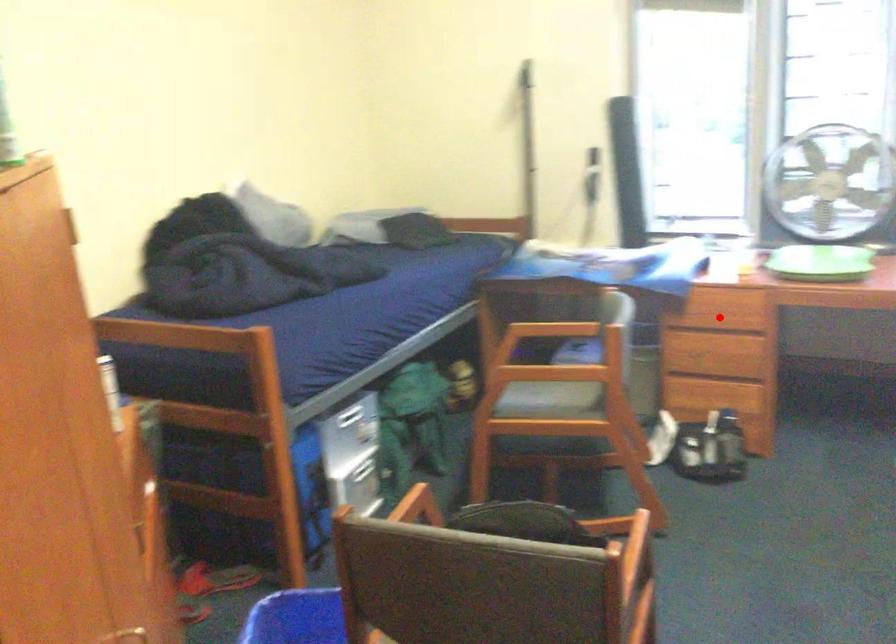
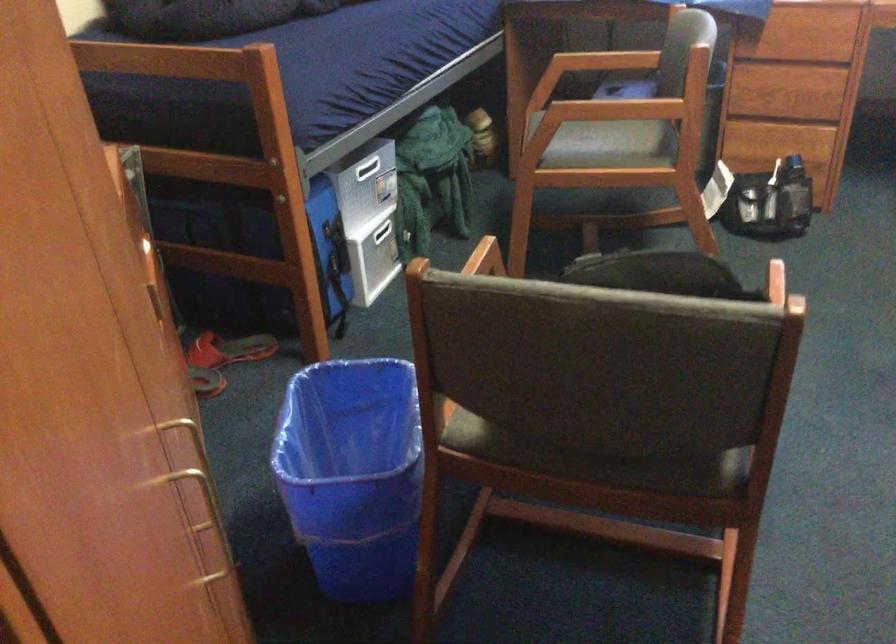
Where in the second image is the point corresponding to the highlighted location from the first image?

(803, 46)